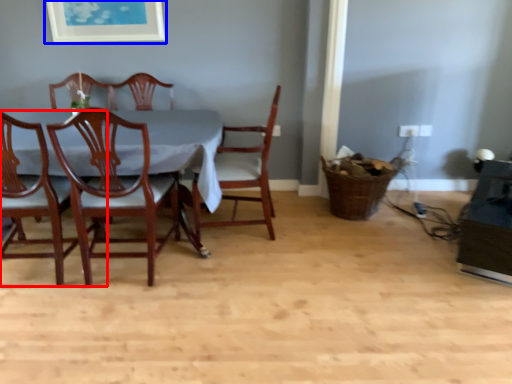
Question: Which object appears closest to the camera in this image, chair (highlighted by a red box) or picture frame (highlighted by a blue box)?

Choices:
 (A) chair
 (B) picture frame

Answer: (A)